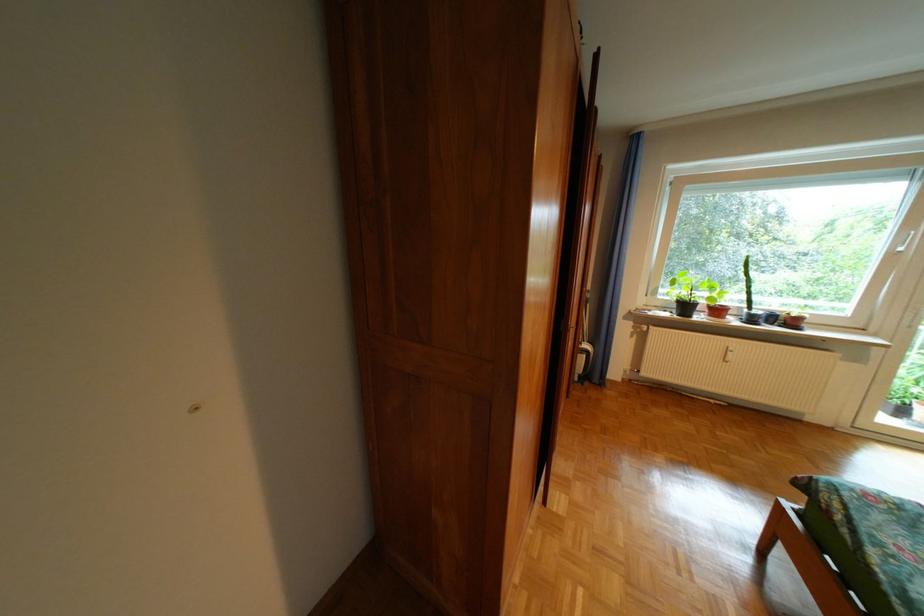
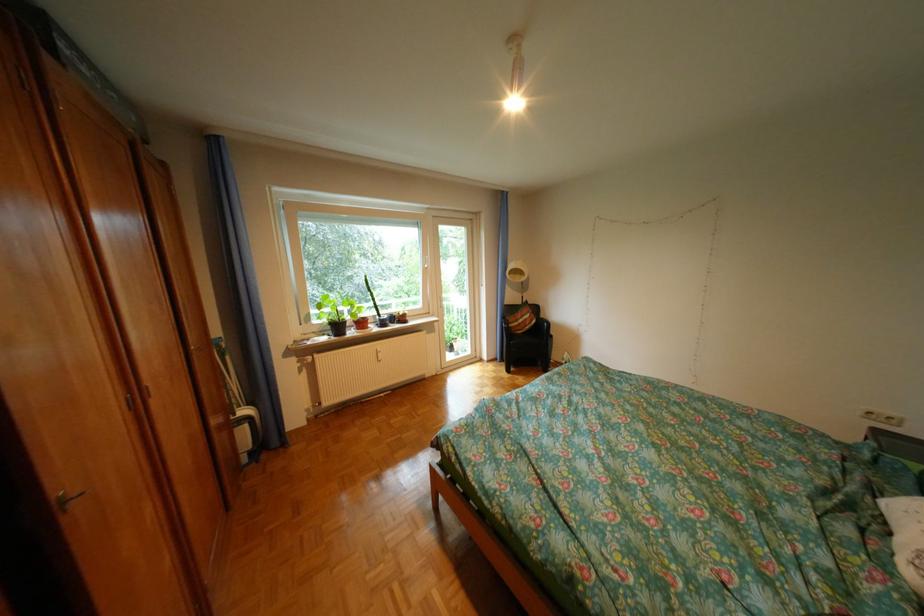
Question: How did the camera likely rotate?

Choices:
 (A) Left
 (B) Right
 (C) Up
 (D) Down

Answer: (B)